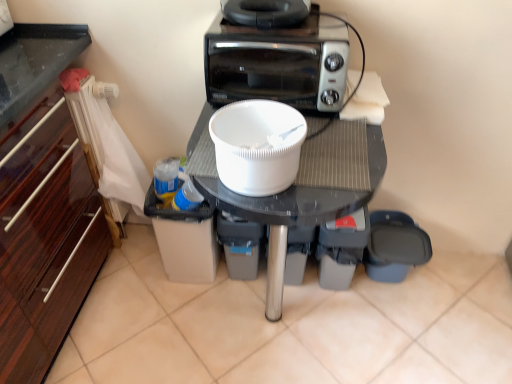
In order to click on vacant point to the left of white plastic table at center in this screenshot , I will do `click(144, 323)`.